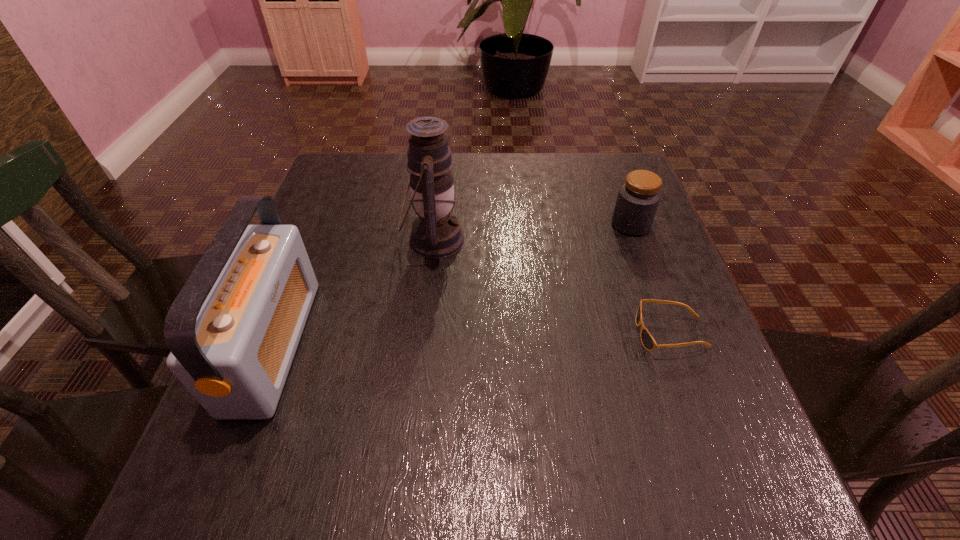
You are a GUI agent. You are given a task and a screenshot of the screen. Output one action in this format:
    pyautogui.click(x=<x>, y=<y>)
    Task: Click on the vacant space in between the sunglasses and the jar
    
    Given the screenshot: What is the action you would take?
    pyautogui.click(x=651, y=279)

Where is `empty space between the sunglasses and the jar`? This screenshot has width=960, height=540. empty space between the sunglasses and the jar is located at coordinates (651, 279).

This screenshot has width=960, height=540. In order to click on object that ranks as the second closest to the radio receiver in this screenshot , I will do `click(648, 342)`.

Identify the location of object that is the second closest to the jar. (436, 233).

This screenshot has height=540, width=960. In order to click on vacant point that satisfies the following two spatial constraints: 1. on the surface of the third tallest object near the warning symbol; 2. on the front-facing side of the shortest object in this screenshot , I will do `click(671, 334)`.

The width and height of the screenshot is (960, 540). Identify the location of vacant region that satisfies the following two spatial constraints: 1. on the surface of the second shortest object near the warning symbol; 2. on the front-facing side of the sunglasses. (671, 334).

I want to click on free space that satisfies the following two spatial constraints: 1. on the surface of the second shortest object near the warning symbol; 2. on the front-facing side of the sunglasses, so [x=671, y=334].

You are a GUI agent. You are given a task and a screenshot of the screen. Output one action in this format:
    pyautogui.click(x=<x>, y=<y>)
    Task: Click on the free space that satisfies the following two spatial constraints: 1. on the surface of the jar near the warning symbol; 2. on the front-facing side of the radio receiver
    This screenshot has width=960, height=540.
    Given the screenshot: What is the action you would take?
    pyautogui.click(x=675, y=345)

Identify the location of blank space that satisfies the following two spatial constraints: 1. on the surface of the jar near the warning symbol; 2. on the front-facing side of the shortest object. (671, 334).

The width and height of the screenshot is (960, 540). In order to click on vacant space that satisfies the following two spatial constraints: 1. on the surface of the second shortest object near the warning symbol; 2. on the front-facing side of the leftmost object in this screenshot , I will do `click(675, 345)`.